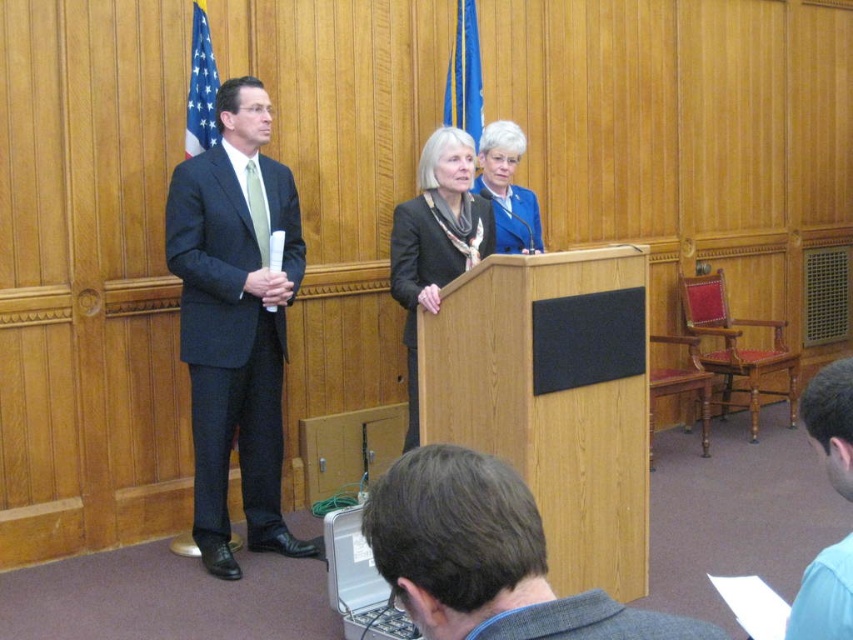
Question: Which of the following is the closest to the observer?

Choices:
 (A) coord(402,236)
 (B) coord(502,250)
 (C) coord(814,634)
 (D) coord(515,513)

Answer: (D)

Question: Can you confirm if gray suit at lower center is positioned above blue shirt at lower right?

Choices:
 (A) yes
 (B) no

Answer: (B)

Question: Where is gray suit at lower center located in relation to blue fabric jacket at center in the image?

Choices:
 (A) below
 (B) above

Answer: (A)

Question: Which of these objects is positioned farthest from the dark gray suit at left?

Choices:
 (A) matte black jacket at center
 (B) blue fabric jacket at center
 (C) blue shirt at lower right

Answer: (C)

Question: Can you confirm if dark gray suit at left is positioned below matte black jacket at center?

Choices:
 (A) no
 (B) yes

Answer: (B)

Question: Which is nearer to the matte black jacket at center?

Choices:
 (A) dark gray suit at left
 (B) blue fabric jacket at center
 (C) blue shirt at lower right
 (D) gray suit at lower center

Answer: (B)